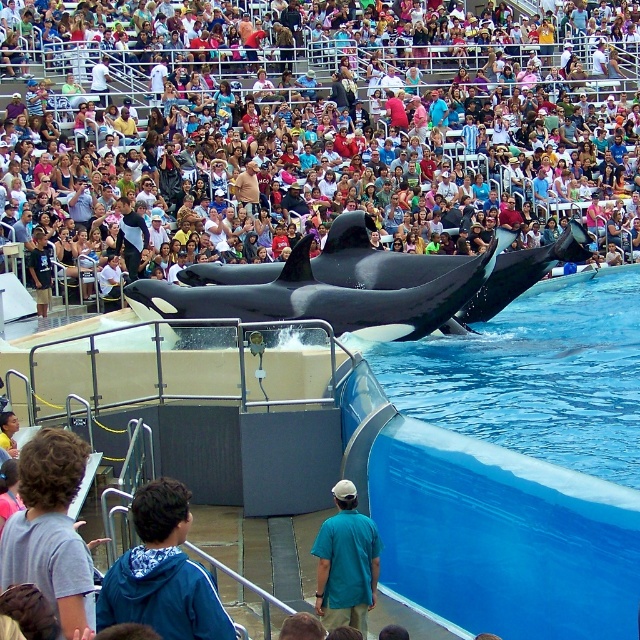
Question: Which point is farther to the camera?

Choices:
 (A) pos(74,540)
 (B) pos(588,241)
 (C) pos(541,376)
 (D) pos(332,529)

Answer: (B)

Question: Estimate the real-world distances between objects in this image. Which object is closer to the blue smooth water at upper right?

Choices:
 (A) multicolored fabric crowd at upper center
 (B) black smooth orca at center
 (C) gray cotton shirt at lower left
 (D) teal shirt at center

Answer: (B)

Question: Where is multicolored fabric crowd at upper center located in relation to teal shirt at center in the image?

Choices:
 (A) left
 (B) right

Answer: (B)

Question: Which point is farther from the camera taking this photo?

Choices:
 (A) (188, 632)
 (B) (586, 435)
 (C) (371, 138)

Answer: (C)

Question: Is multicolored fabric crowd at upper center to the right of blue smooth water at upper right from the viewer's perspective?

Choices:
 (A) no
 (B) yes

Answer: (A)

Question: Where is black smooth orca at center located in relation to teal shirt at center in the image?

Choices:
 (A) above
 (B) below

Answer: (A)